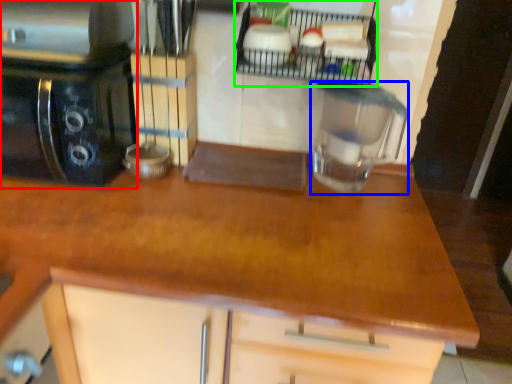
Question: Which object is positioned closest to home appliance (highlighted by a red box)? Select from kitchen appliance (highlighted by a blue box) and shelf (highlighted by a green box).

Choices:
 (A) kitchen appliance
 (B) shelf

Answer: (B)